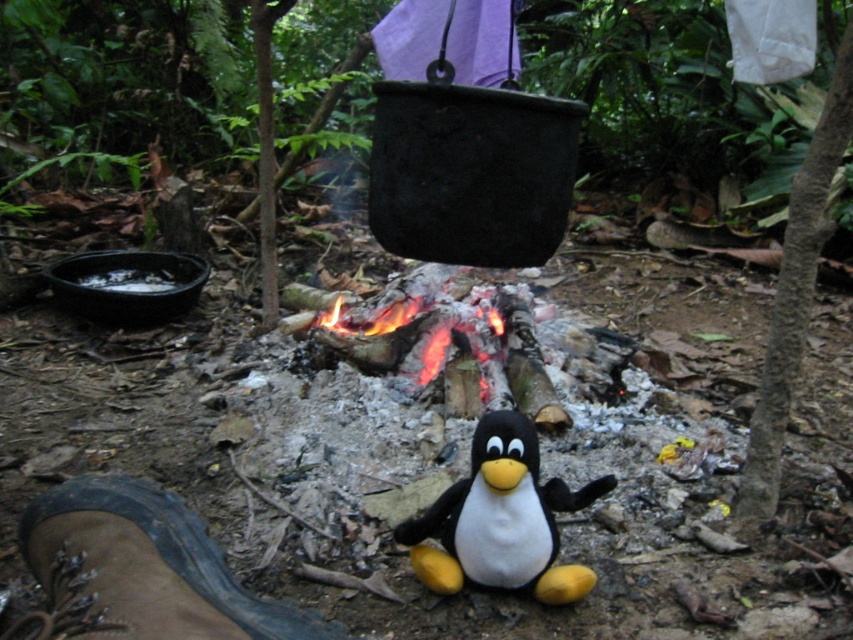
Is black plush penguin at center further to camera compared to brown leather boot at lower left?

Yes, black plush penguin at center is further from the viewer.

Can you confirm if black plush penguin at center is wider than brown leather boot at lower left?

Incorrect, black plush penguin at center's width does not surpass brown leather boot at lower left's.

Is point (573, 499) more distant than point (183, 564)?

That is True.

The image size is (853, 640). What are the coordinates of `black plush penguin at center` in the screenshot? It's located at tap(502, 518).